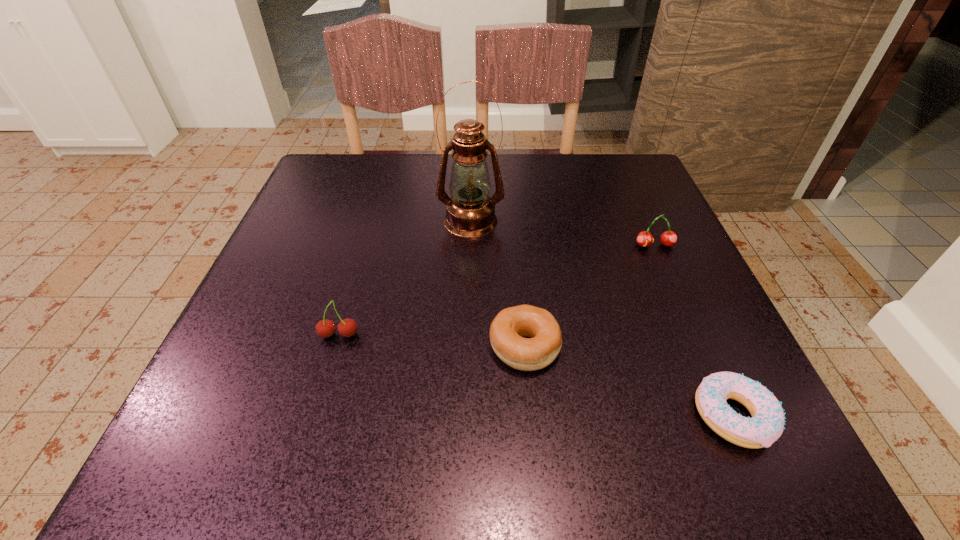
Locate an element on the screen. The image size is (960, 540). free space between the doughnut and the bagel is located at coordinates (629, 381).

You are a GUI agent. You are given a task and a screenshot of the screen. Output one action in this format:
    pyautogui.click(x=<x>, y=<y>)
    Task: Click on the free space that is in between the oil lamp and the left cherry
    The image size is (960, 540).
    Given the screenshot: What is the action you would take?
    pyautogui.click(x=405, y=278)

Where is `vacant point located between the second farthest object and the farthest object`? The image size is (960, 540). vacant point located between the second farthest object and the farthest object is located at coordinates (563, 233).

You are a GUI agent. You are given a task and a screenshot of the screen. Output one action in this format:
    pyautogui.click(x=<x>, y=<y>)
    Task: Click on the vacant region between the bagel and the nearest object
    This screenshot has height=540, width=960.
    Given the screenshot: What is the action you would take?
    pyautogui.click(x=629, y=381)

Identify the location of object that is the second closest to the nearest object. (669, 238).

Find the location of a particular element. object that is the third nearest to the nearest object is located at coordinates click(470, 212).

At what (x,y) coordinates should I click in order to perform the action: click on free space in the image that satisfies the following two spatial constraints: 1. on the surface of the left cherry; 2. on the right side of the nearest object. Please return your answer as a coordinate pair (x, y). Looking at the image, I should click on (315, 416).

Image resolution: width=960 pixels, height=540 pixels. I want to click on free location that satisfies the following two spatial constraints: 1. on the surface of the bagel; 2. on the left side of the left cherry, so click(x=336, y=346).

Locate an element on the screen. free region that satisfies the following two spatial constraints: 1. on the surface of the bagel; 2. on the right side of the leftmost object is located at coordinates (336, 346).

At what (x,y) coordinates should I click in order to perform the action: click on free location that satisfies the following two spatial constraints: 1. on the front side of the doughnut; 2. on the left side of the bagel. Please return your answer as a coordinate pair (x, y). Looking at the image, I should click on (531, 416).